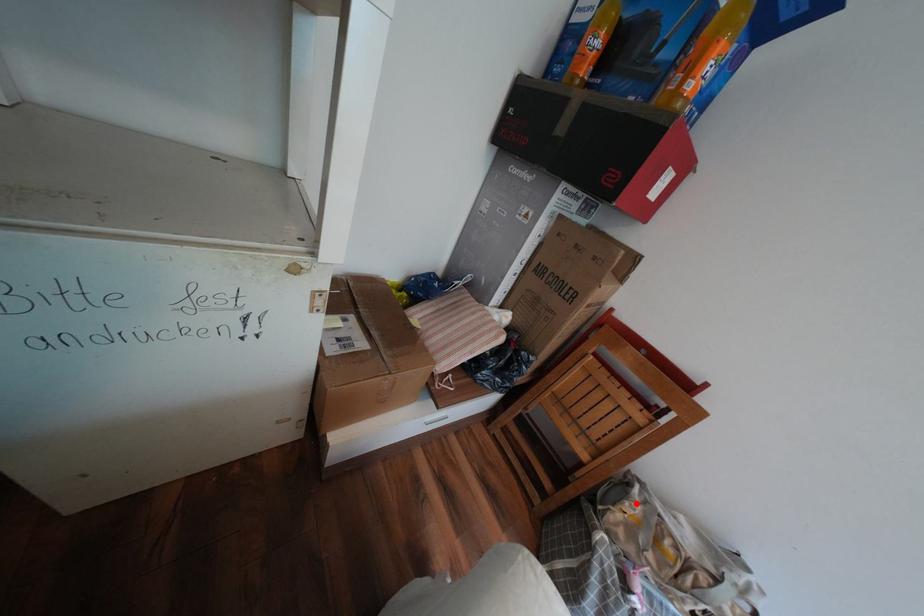
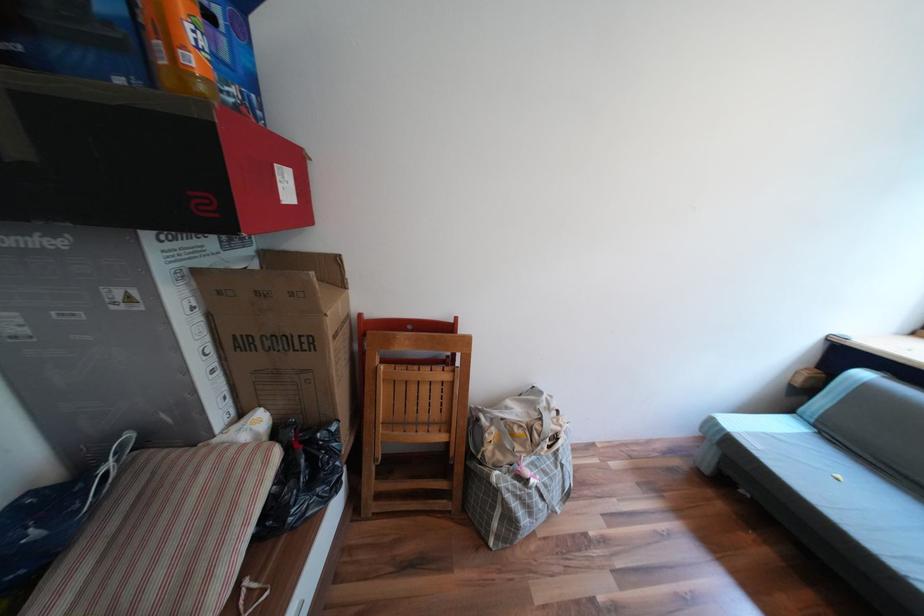
Question: A red point is marked in image1. In image2, is the corresponding 3D point closer to the camera or farther? Reply with the corresponding letter.

Choices:
 (A) The corresponding 3D point is closer.
 (B) The corresponding 3D point is farther.

Answer: (B)